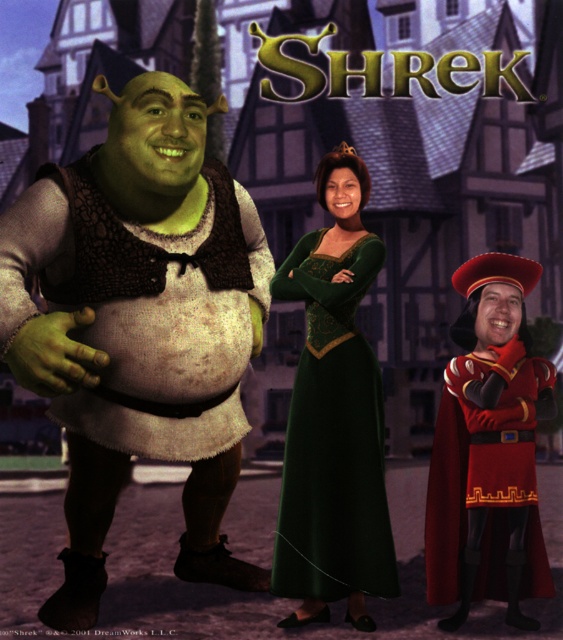
Question: Does brown textured vest at left appear on the right side of shiny red armor at right?

Choices:
 (A) no
 (B) yes

Answer: (A)

Question: Which point is farther from the camera taking this photo?

Choices:
 (A) (119, 417)
 (B) (330, 275)
 (C) (535, 554)

Answer: (C)

Question: Which point is closer to the camera?

Choices:
 (A) green velvet dress at center
 (B) shiny red armor at right

Answer: (B)

Question: In this image, where is shiny red armor at right located relative to green velvet dress at center?

Choices:
 (A) above
 (B) below

Answer: (B)

Question: Estimate the real-world distances between objects in this image. Which object is closer to the green velvet dress at center?

Choices:
 (A) brown textured vest at left
 (B) shiny red armor at right

Answer: (B)

Question: In this image, where is shiny red armor at right located relative to green velvet dress at center?

Choices:
 (A) above
 (B) below

Answer: (B)